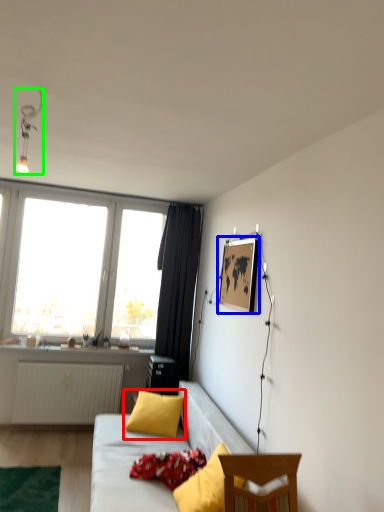
Question: Which is nearer to the pillow (highlighted by a red box)? picture frame (highlighted by a blue box) or light fixture (highlighted by a green box).

Choices:
 (A) picture frame
 (B) light fixture

Answer: (A)